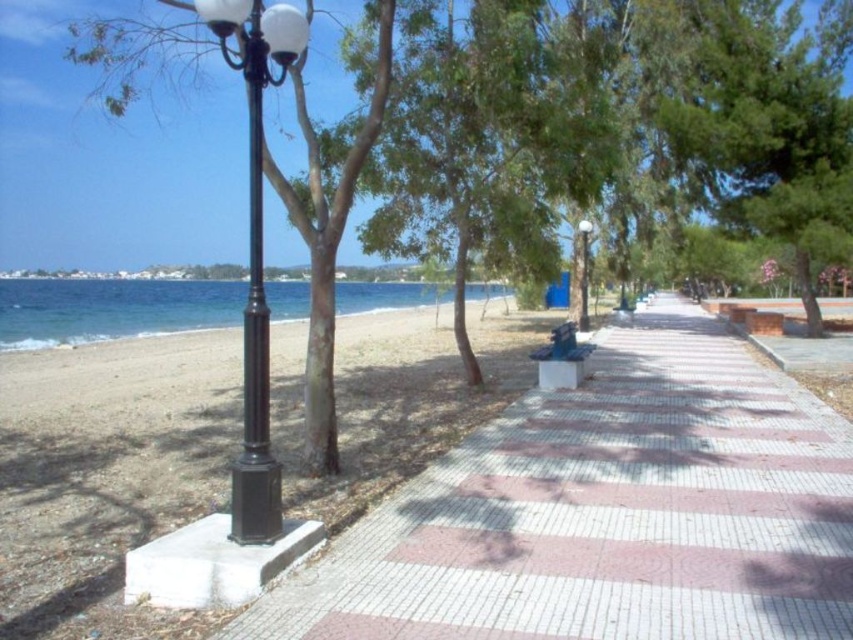
Question: Can you confirm if white tile pavement at center is positioned to the right of blue painted wood bench at center?

Choices:
 (A) no
 (B) yes

Answer: (B)

Question: Which object is closer to the camera taking this photo?

Choices:
 (A) sandy beach at left
 (B) blue painted wood bench at center
 (C) white tile pavement at center

Answer: (C)

Question: Is sandy beach at left to the right of blue water at lower left from the viewer's perspective?

Choices:
 (A) yes
 (B) no

Answer: (A)

Question: Which object appears farthest from the camera in this image?

Choices:
 (A) blue water at lower left
 (B) black polished metal street light at left
 (C) sandy beach at left
 (D) black metal pole at left

Answer: (A)

Question: Which object appears farthest from the camera in this image?

Choices:
 (A) blue painted wood bench at center
 (B) white tile pavement at center

Answer: (A)

Question: Does blue water at lower left appear on the left side of black metal street light at center?

Choices:
 (A) yes
 (B) no

Answer: (A)